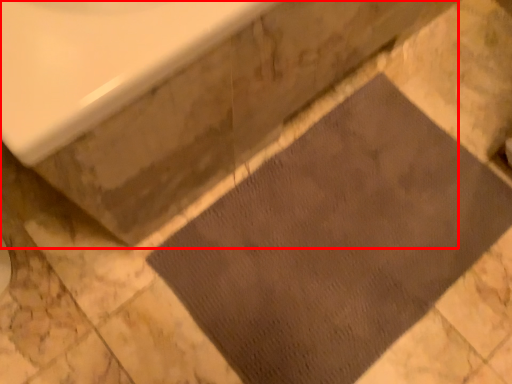
Question: Where is bath (annotated by the red box) located in relation to doormat in the image?

Choices:
 (A) left
 (B) right

Answer: (A)